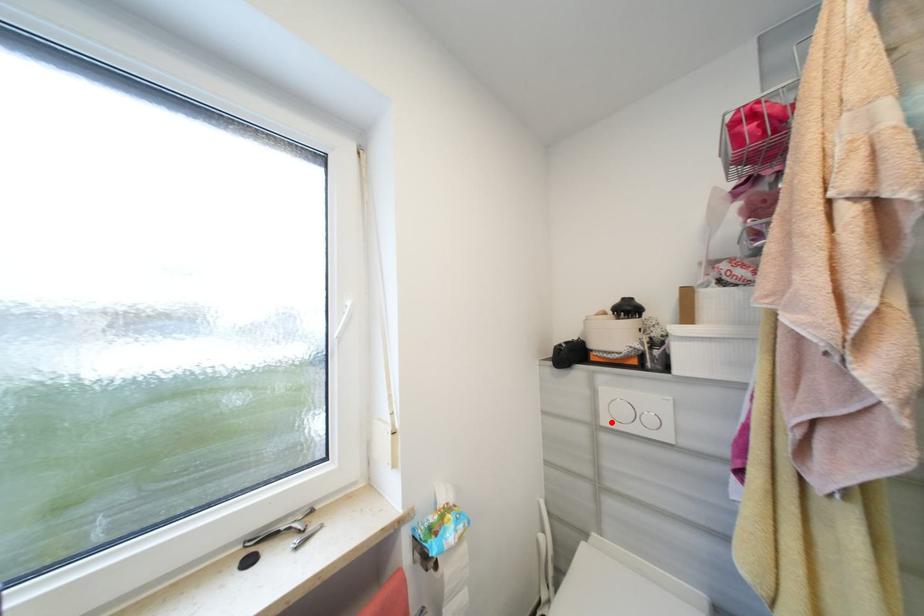
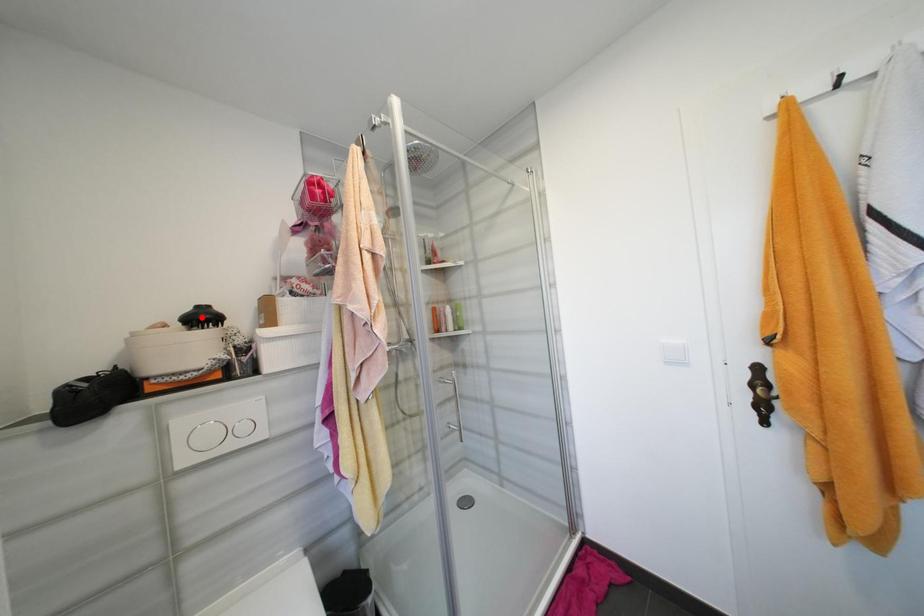
I am providing you with two images of the same scene from different viewpoints. A red point is marked on the first image and another point is marked on the second image. Is the red point in image1 aligned with the point shown in image2?

No